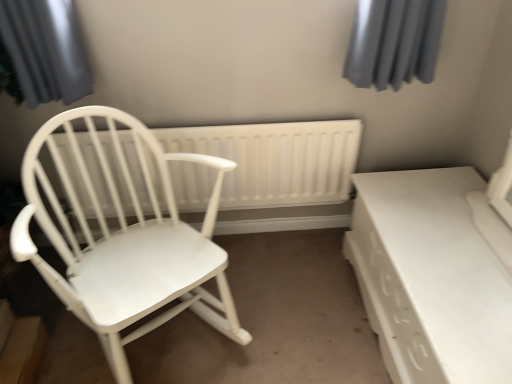
Question: Is white glossy table at lower right at the left side of white plastic radiator at center?

Choices:
 (A) yes
 (B) no

Answer: (B)

Question: From a real-world perspective, is white glossy table at lower right positioned under white plastic radiator at center based on gravity?

Choices:
 (A) no
 (B) yes

Answer: (B)

Question: Is white glossy table at lower right oriented towards white plastic radiator at center?

Choices:
 (A) no
 (B) yes

Answer: (B)

Question: From the image's perspective, is white glossy table at lower right located above white plastic radiator at center?

Choices:
 (A) no
 (B) yes

Answer: (A)

Question: Is white glossy table at lower right taller than white plastic radiator at center?

Choices:
 (A) yes
 (B) no

Answer: (B)

Question: Considering the relative positions of white glossy table at lower right and white plastic radiator at center in the image provided, is white glossy table at lower right behind white plastic radiator at center?

Choices:
 (A) no
 (B) yes

Answer: (A)

Question: Is white plastic radiator at center to the left of white matte wood chair at left from the viewer's perspective?

Choices:
 (A) yes
 (B) no

Answer: (B)

Question: Does white plastic radiator at center have a lesser width compared to white matte wood chair at left?

Choices:
 (A) yes
 (B) no

Answer: (A)

Question: From a real-world perspective, is white plastic radiator at center located beneath white matte wood chair at left?

Choices:
 (A) yes
 (B) no

Answer: (A)

Question: Can you confirm if white plastic radiator at center is positioned to the right of white matte wood chair at left?

Choices:
 (A) no
 (B) yes

Answer: (B)

Question: Is white plastic radiator at center turned away from white matte wood chair at left?

Choices:
 (A) no
 (B) yes

Answer: (B)

Question: Considering the relative sizes of white plastic radiator at center and white matte wood chair at left in the image provided, is white plastic radiator at center smaller than white matte wood chair at left?

Choices:
 (A) yes
 (B) no

Answer: (A)

Question: Is white matte wood chair at left placed right next to white plastic radiator at center?

Choices:
 (A) yes
 (B) no

Answer: (B)